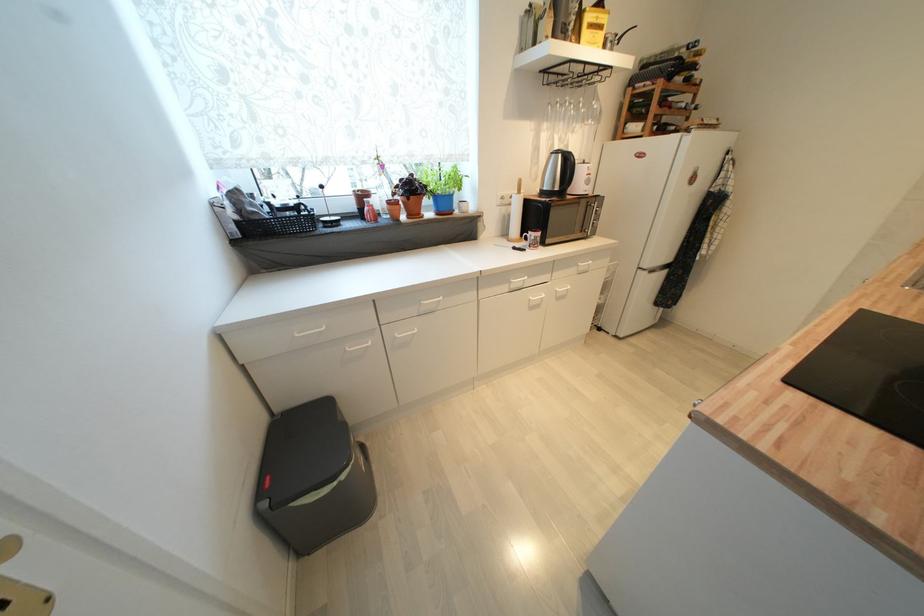
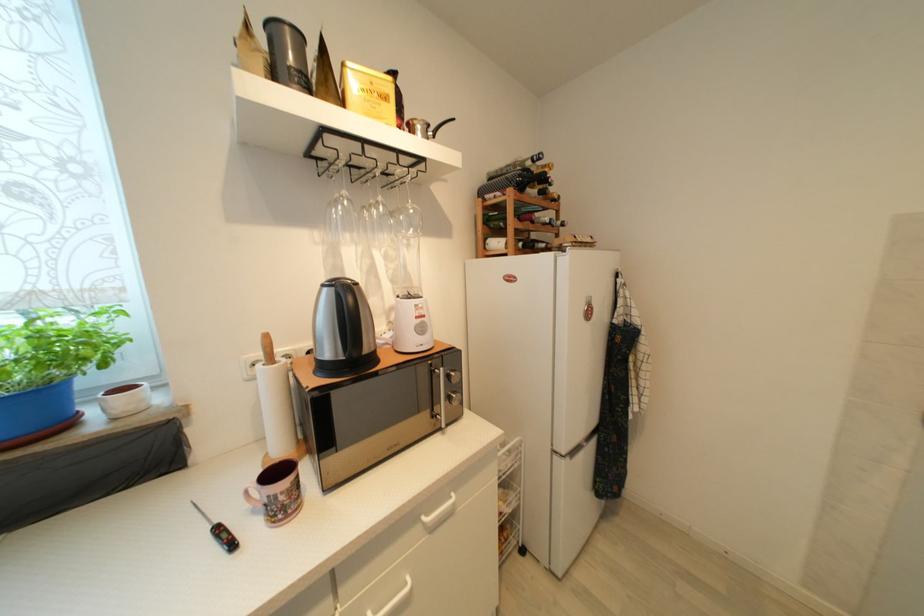
Locate, in the second image, the point that corresponds to pixel 606 29 in the first image.

(391, 100)